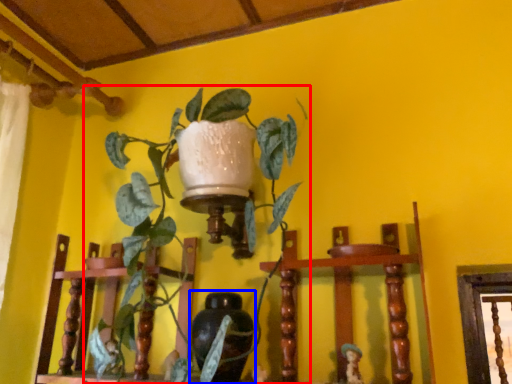
Question: Which of the following is the farthest to the observer, houseplant (highlighted by a red box) or vase (highlighted by a blue box)?

Choices:
 (A) houseplant
 (B) vase

Answer: (B)